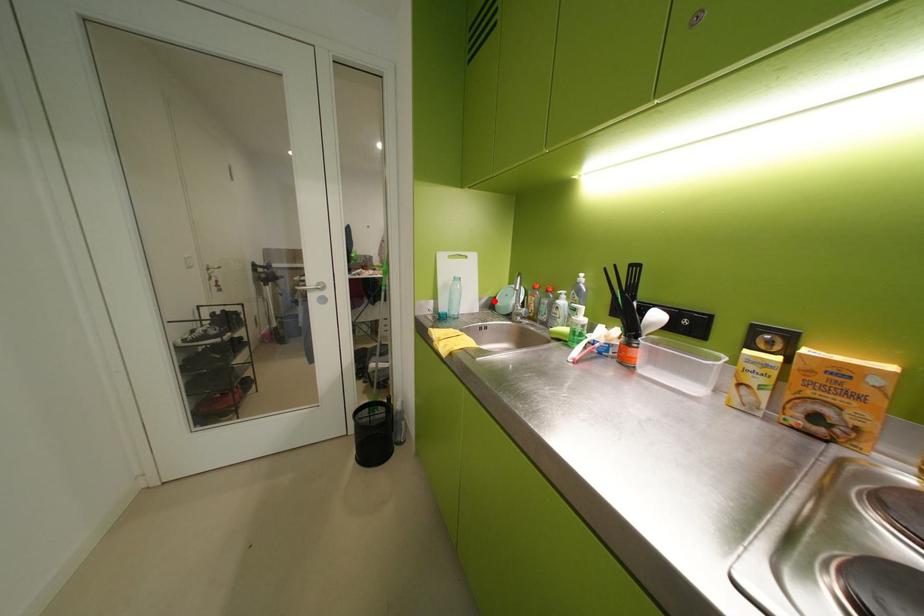
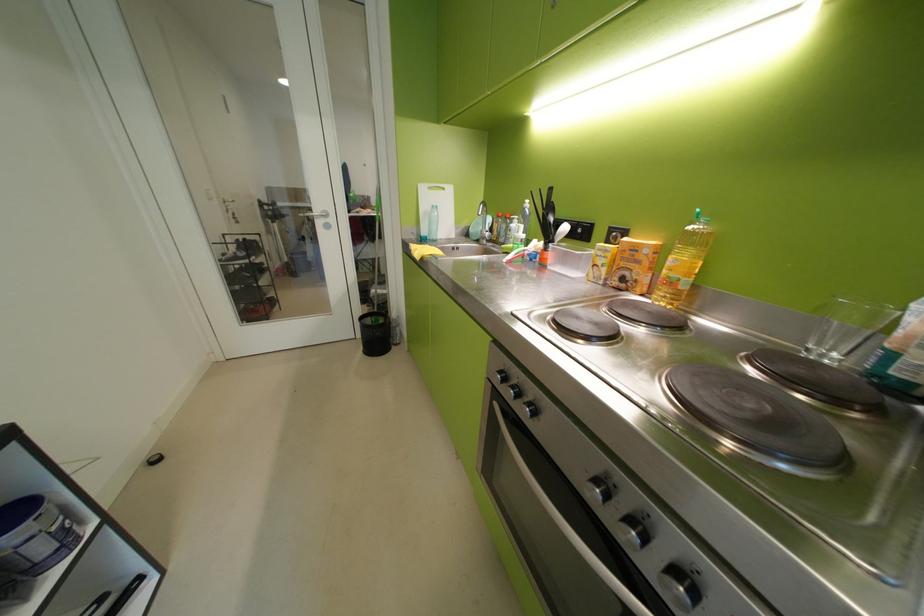
The point at the highlighted location is marked in the first image. Where is the corresponding point in the second image?

(470, 230)